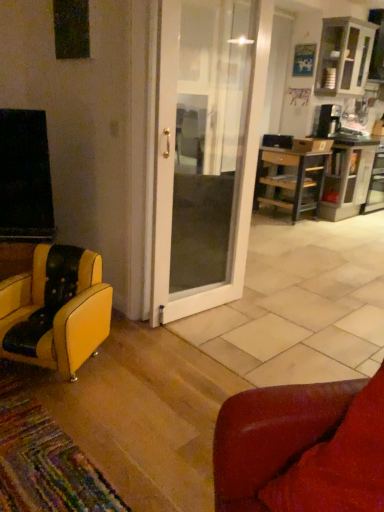
Question: Should I look upward or downward to see leather couch at lower right, positioned as the 1th chair in right-to-left order?

Choices:
 (A) down
 (B) up

Answer: (A)

Question: Is wooden desk at right shorter than wooden cabinet at right?

Choices:
 (A) yes
 (B) no

Answer: (A)

Question: Is the surface of wooden desk at right in direct contact with wooden cabinet at right?

Choices:
 (A) no
 (B) yes

Answer: (A)

Question: Is wooden desk at right completely or partially outside of wooden cabinet at right?

Choices:
 (A) no
 (B) yes

Answer: (B)

Question: From a real-world perspective, does wooden desk at right sit lower than wooden cabinet at right?

Choices:
 (A) yes
 (B) no

Answer: (A)

Question: Considering the relative sizes of wooden desk at right and wooden cabinet at right in the image provided, is wooden desk at right bigger than wooden cabinet at right?

Choices:
 (A) no
 (B) yes

Answer: (A)

Question: From a real-world perspective, does wooden desk at right stand above wooden cabinet at right?

Choices:
 (A) no
 (B) yes

Answer: (A)

Question: From a real-world perspective, is leather couch at lower right, the second chair viewed from the back, located beneath white glossy cabinet at upper right?

Choices:
 (A) no
 (B) yes

Answer: (B)

Question: Can you confirm if leather couch at lower right, which is counted as the second chair, starting from the left, is positioned to the right of white glossy cabinet at upper right?

Choices:
 (A) yes
 (B) no

Answer: (B)

Question: Does leather couch at lower right, marked as the first chair in a front-to-back arrangement, have a larger size compared to white glossy cabinet at upper right?

Choices:
 (A) yes
 (B) no

Answer: (B)

Question: Is leather couch at lower right, which is counted as the second chair, starting from the left, turned away from white glossy cabinet at upper right?

Choices:
 (A) no
 (B) yes

Answer: (A)

Question: Is leather couch at lower right, marked as the first chair in a front-to-back arrangement, in front of white glossy cabinet at upper right?

Choices:
 (A) yes
 (B) no

Answer: (A)

Question: Could white glossy cabinet at upper right be considered to be inside leather couch at lower right, the second chair viewed from the back?

Choices:
 (A) yes
 (B) no

Answer: (B)

Question: From a real-world perspective, is yellow leather chair at lower left, the 1th chair when ordered from left to right, physically below wooden cabinet at right?

Choices:
 (A) yes
 (B) no

Answer: (A)